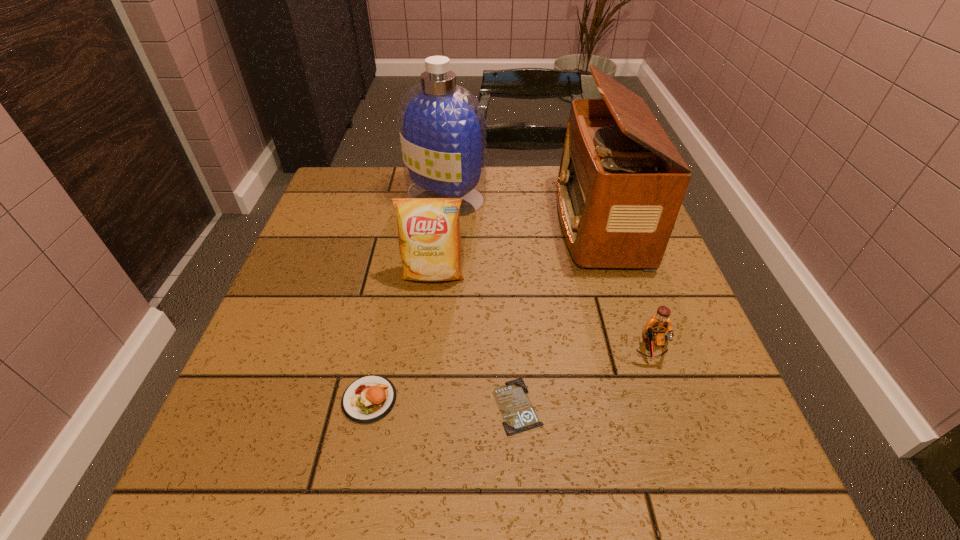
Identify the location of cleansing agent. This screenshot has height=540, width=960. (442, 127).

Locate an element on the screen. This screenshot has width=960, height=540. radio receiver is located at coordinates (618, 196).

Identify the location of crisp (potato chip). (429, 236).

Identify the location of Lego. (656, 327).

This screenshot has width=960, height=540. Find the location of `the third nearest object`. the third nearest object is located at coordinates (656, 327).

Identify the location of patty (food). The image size is (960, 540). (368, 399).

This screenshot has width=960, height=540. What are the coordinates of `the shortest object` in the screenshot? It's located at (517, 411).

Locate an element on the screen. The image size is (960, 540). identity card is located at coordinates (517, 411).

Find the location of a particular element. The height and width of the screenshot is (540, 960). free space located 0.270m on the right of the cleansing agent is located at coordinates (585, 195).

This screenshot has height=540, width=960. Identify the location of vacant space located 0.360m on the front panel of the radio receiver. (418, 222).